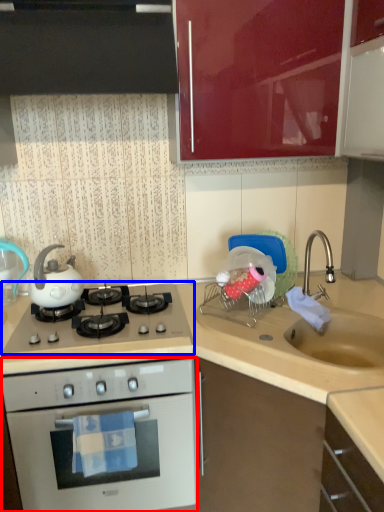
Question: Which of the following is the farthest to the observer, oven (highlighted by a red box) or gas stove (highlighted by a blue box)?

Choices:
 (A) oven
 (B) gas stove

Answer: (B)